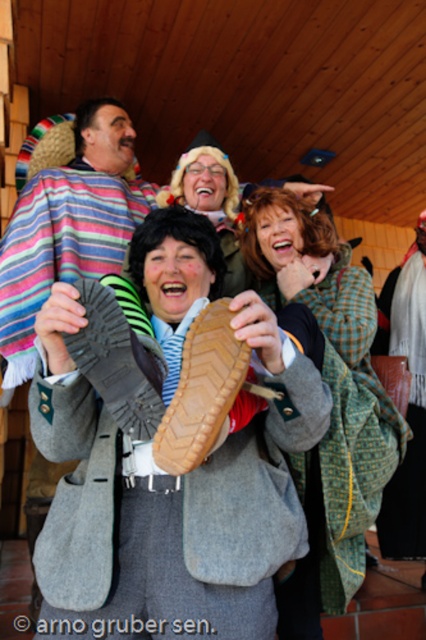
Question: In this image, where is green plaid coat at center located relative to rubber/textured shoe at center?

Choices:
 (A) right
 (B) left

Answer: (A)

Question: Which object is closer to the camera taking this photo?

Choices:
 (A) rubber/textured shoe at center
 (B) green plaid coat at center

Answer: (A)

Question: Does green plaid coat at center have a lesser width compared to brown leather shoe at center?

Choices:
 (A) yes
 (B) no

Answer: (B)

Question: Considering the relative positions of green plaid coat at center and rubber/textured shoe at center in the image provided, where is green plaid coat at center located with respect to rubber/textured shoe at center?

Choices:
 (A) below
 (B) above

Answer: (A)

Question: Which of the following is the farthest from the observer?

Choices:
 (A) rubber/textured shoe at center
 (B) green plaid coat at center
 (C) brown leather shoe at center

Answer: (B)

Question: Which point is farther to the camera?

Choices:
 (A) brown leather shoe at center
 (B) green plaid coat at center

Answer: (B)